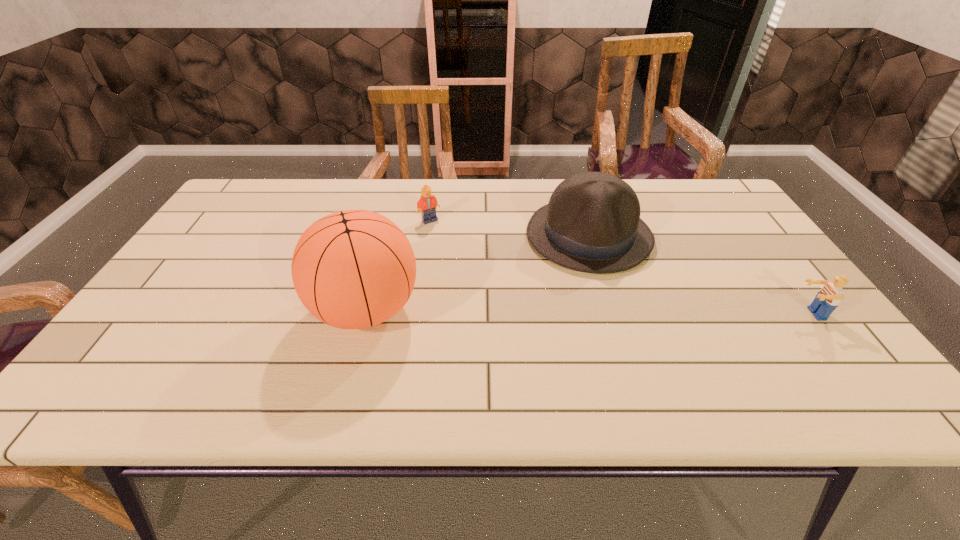
Locate an element on the screen. vacant space situated on the face of the right Lego is located at coordinates (638, 314).

This screenshot has width=960, height=540. What are the coordinates of `vacant space located 0.270m on the front-facing side of the bowler hat` in the screenshot? It's located at (502, 333).

Find the location of a particular element. This screenshot has width=960, height=540. vacant area situated 0.090m on the front-facing side of the bowler hat is located at coordinates (542, 288).

Locate an element on the screen. The height and width of the screenshot is (540, 960). vacant space located on the front-facing side of the bowler hat is located at coordinates (518, 314).

Locate an element on the screen. The height and width of the screenshot is (540, 960). blank space located on the front-facing side of the left Lego is located at coordinates (527, 276).

Locate an element on the screen. This screenshot has width=960, height=540. vacant area located 0.340m on the front-facing side of the left Lego is located at coordinates (527, 276).

Locate an element on the screen. The height and width of the screenshot is (540, 960). free spot located on the front-facing side of the left Lego is located at coordinates (504, 262).

Identify the location of free space located on the shell of the escargot. The image size is (960, 540). (385, 241).

Where is `blank space located on the shell of the escargot`? This screenshot has width=960, height=540. blank space located on the shell of the escargot is located at coordinates (444, 270).

Where is `free space located 0.280m on the shell of the escargot`? This screenshot has height=540, width=960. free space located 0.280m on the shell of the escargot is located at coordinates (435, 266).